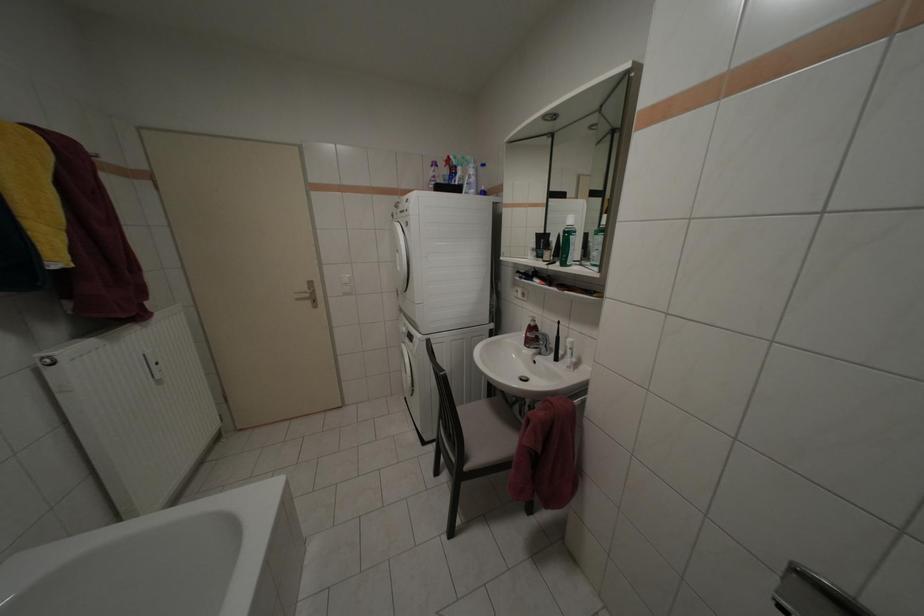
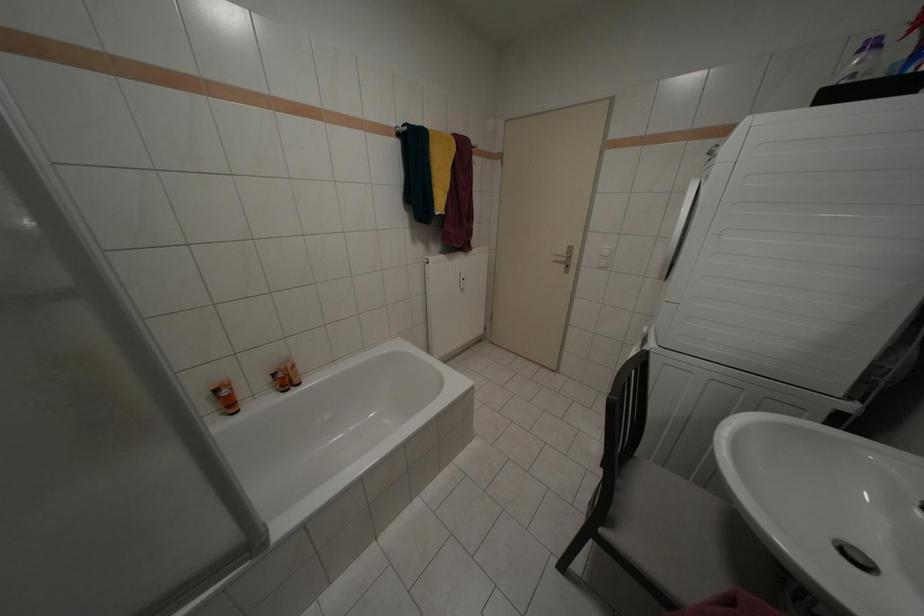
First-person continuous shooting, in which direction is the camera rotating?

The rotation direction of the camera is left-down.